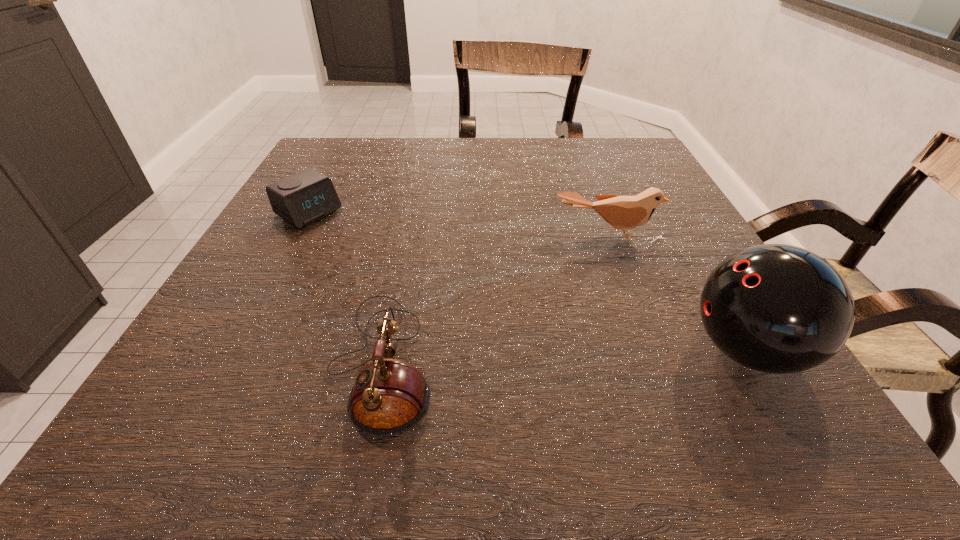
This screenshot has height=540, width=960. In order to click on bowling ball present at the right edge in this screenshot , I will do `click(775, 308)`.

In order to click on bird located in the right edge section of the desktop in this screenshot , I will do `click(622, 212)`.

This screenshot has width=960, height=540. Find the location of `object present at the near right corner`. object present at the near right corner is located at coordinates (775, 308).

Locate an element on the screen. The width and height of the screenshot is (960, 540). vacant space at the far edge of the desktop is located at coordinates coord(428,141).

Locate an element on the screen. The image size is (960, 540). free space at the near edge of the desktop is located at coordinates (601, 369).

Identify the location of free region at the left edge. (279, 302).

Where is `free location at the right edge of the desktop`? Image resolution: width=960 pixels, height=540 pixels. free location at the right edge of the desktop is located at coordinates (681, 284).

The width and height of the screenshot is (960, 540). What are the coordinates of `free region at the far left corner` in the screenshot? It's located at (348, 177).

The height and width of the screenshot is (540, 960). In the image, there is a desktop. Find the location of `vacant area at the near left corner`. vacant area at the near left corner is located at coordinates (262, 380).

Locate an element on the screen. vacant space at the far right corner is located at coordinates (625, 164).